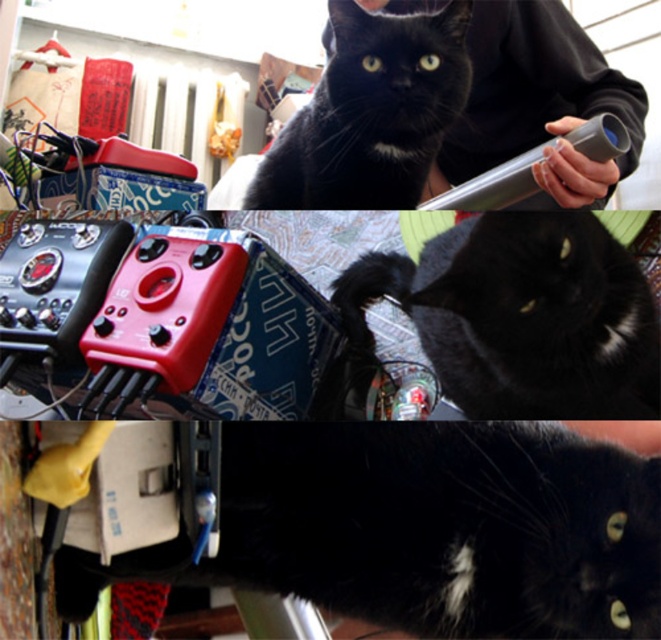
Which is below, black fur cat at center or black glossy cat at center?

black fur cat at center is below.

Is black fur cat at center to the right of black glossy cat at center from the viewer's perspective?

In fact, black fur cat at center is to the left of black glossy cat at center.

Between point (574, 600) and point (578, 232), which one is positioned behind?

The point (578, 232) is more distant.

Where is `black fur cat at center`? black fur cat at center is located at coordinates (422, 529).

Can you confirm if black glossy cat at center is thinner than black fur cat at upper center?

Yes, black glossy cat at center is thinner than black fur cat at upper center.

Does black glossy cat at center appear over black fur cat at upper center?

No.

Locate an element on the screen. Image resolution: width=661 pixels, height=640 pixels. black glossy cat at center is located at coordinates (522, 316).

The image size is (661, 640). In order to click on black glossy cat at center in this screenshot , I will do `click(522, 316)`.

Which is behind, point (299, 531) or point (442, 52)?

The point (442, 52) is behind.

Can you confirm if black fur cat at center is bigger than black fur cat at upper center?

No.

Who is more distant from viewer, (x=412, y=570) or (x=373, y=106)?

The point (x=373, y=106) is more distant.

This screenshot has height=640, width=661. Identify the location of black fur cat at center. (422, 529).